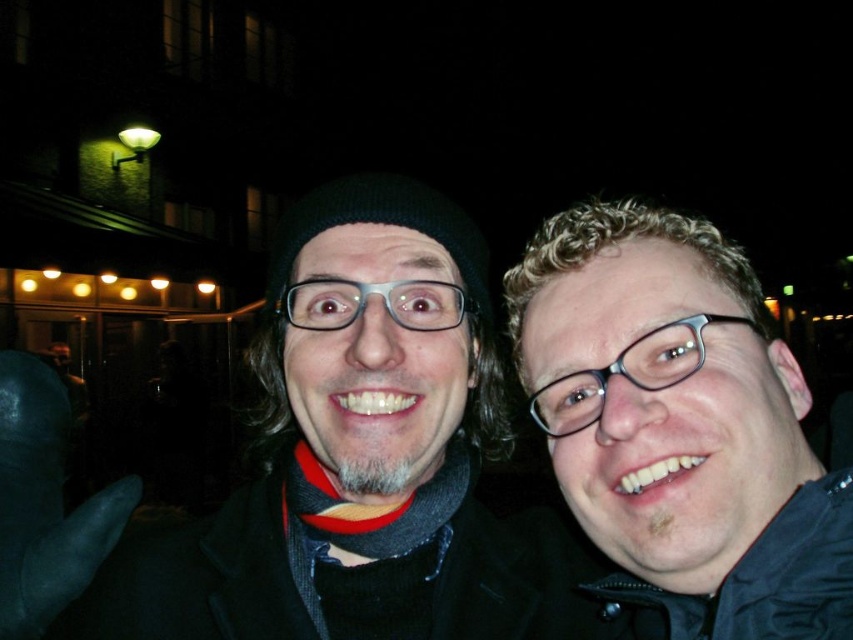
You are a photographer trying to adjust the lighting for two subjects wearing matte black jackets. You notice that the matte black jacket at center and the matte black jacket at right are positioned in the scene. Based on their positions, which matte black jacket is closer to the left side of the image?

The matte black jacket at center is closer to the left side of the image because it is positioned to the left of the matte black jacket at right.